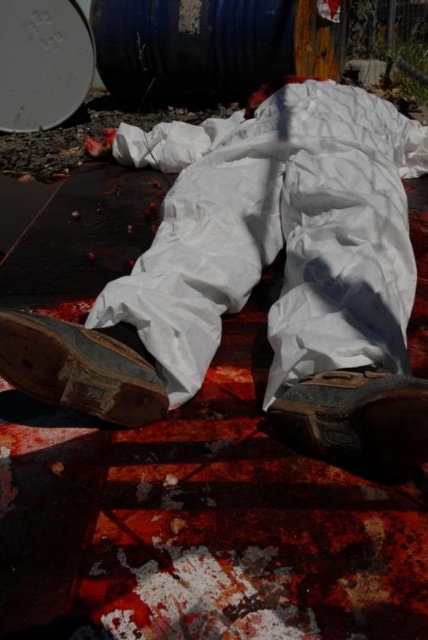
Between point (397, 404) and point (410, 397), which one is positioned in front?

Point (410, 397) is more forward.

What do you see at coordinates (249, 292) in the screenshot? The image size is (428, 640). I see `white matte suit at center` at bounding box center [249, 292].

The width and height of the screenshot is (428, 640). What do you see at coordinates (249, 292) in the screenshot?
I see `white matte suit at center` at bounding box center [249, 292].

Locate an element on the screen. white matte suit at center is located at coordinates (249, 292).

Which is above, white matte suit at center or brown leather shoe at lower left?

white matte suit at center

Which of these two, white matte suit at center or brown leather shoe at lower left, stands taller?

white matte suit at center

What do you see at coordinates (249, 292) in the screenshot?
I see `white matte suit at center` at bounding box center [249, 292].

You are a GUI agent. You are given a task and a screenshot of the screen. Output one action in this format:
    pyautogui.click(x=<x>, y=<y>)
    Task: Click on the white matte suit at center
    The image size is (428, 640).
    Given the screenshot: What is the action you would take?
    pyautogui.click(x=249, y=292)

Where is `blue metallic barrel at upper center`? The image size is (428, 640). blue metallic barrel at upper center is located at coordinates (207, 48).